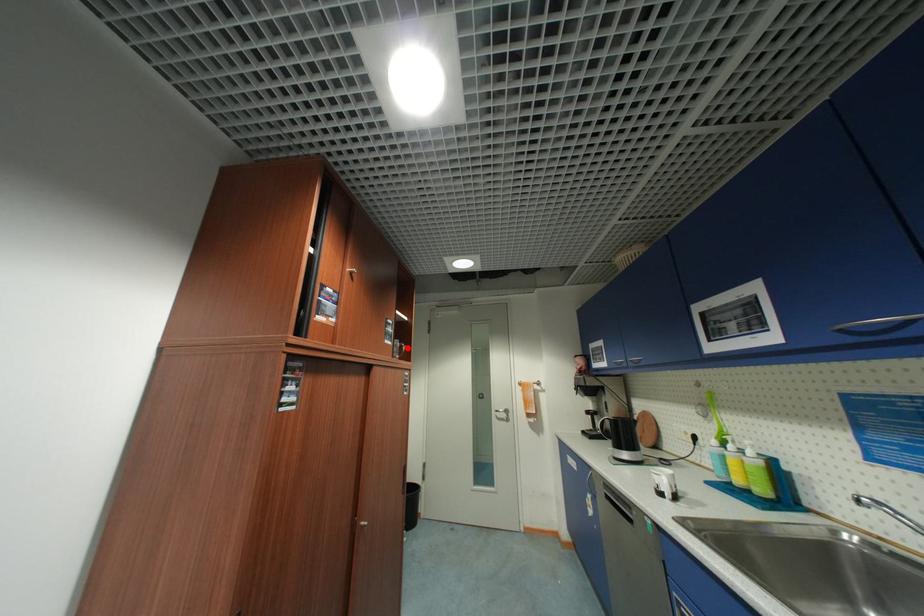
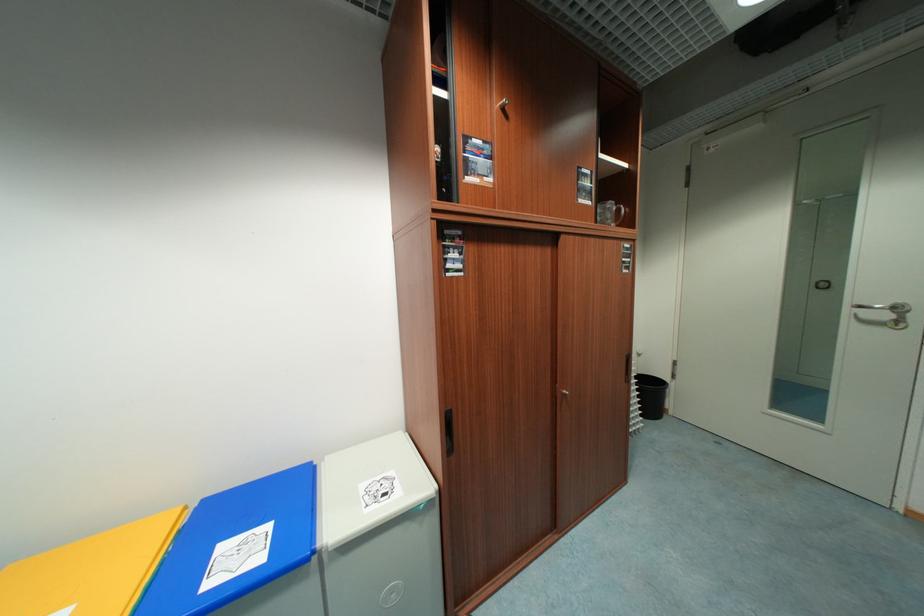
Locate, in the second image, the point that corresponds to the highlighted location in the first image.

(624, 211)